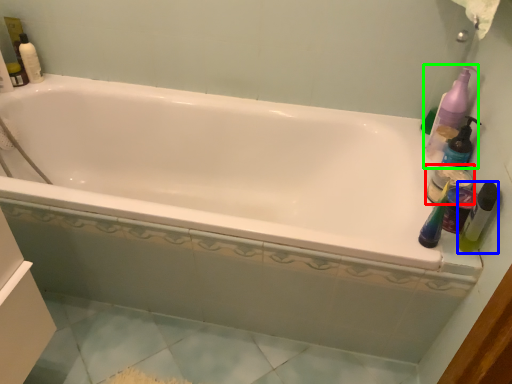
Question: Which object is positioned closest to mouthwash (highlighted by a red box)? Select from mouthwash (highlighted by a blue box) and cleaning product (highlighted by a green box).

Choices:
 (A) mouthwash
 (B) cleaning product

Answer: (A)